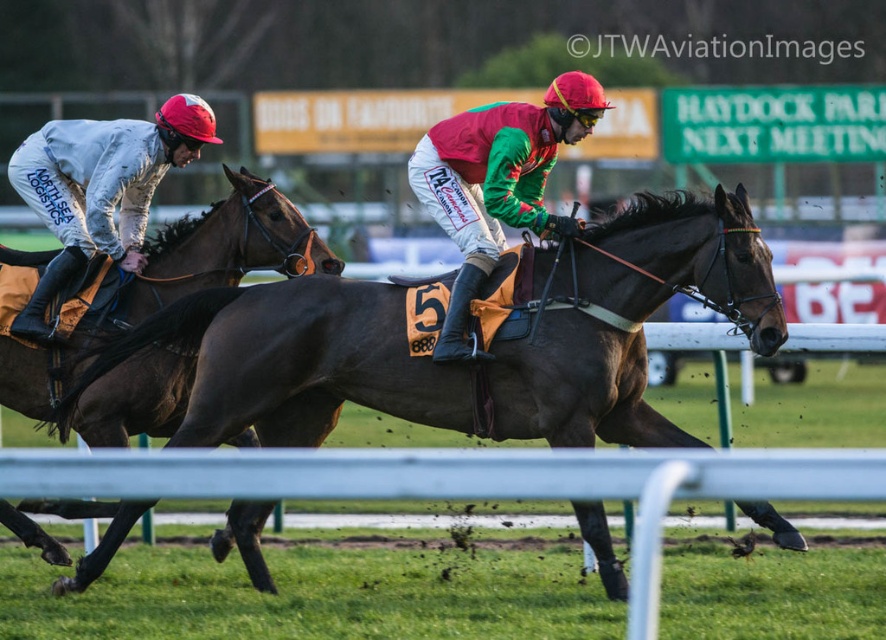
Question: Can you confirm if brown glossy horse at left is positioned above green and red jersey at center?

Choices:
 (A) yes
 (B) no

Answer: (B)

Question: Is shiny brown horse at center positioned at the back of matte white jockey suit at left?

Choices:
 (A) no
 (B) yes

Answer: (A)

Question: Which of the following is the farthest from the observer?

Choices:
 (A) brown glossy horse at left
 (B) matte white jockey suit at left

Answer: (B)

Question: Which is nearer to the green and red jersey at center?

Choices:
 (A) shiny brown horse at center
 (B) matte white jockey suit at left

Answer: (A)

Question: Which point is closer to the camera?

Choices:
 (A) shiny brown horse at center
 (B) brown glossy horse at left

Answer: (A)

Question: Does shiny brown horse at center come behind matte white jockey suit at left?

Choices:
 (A) yes
 (B) no

Answer: (B)